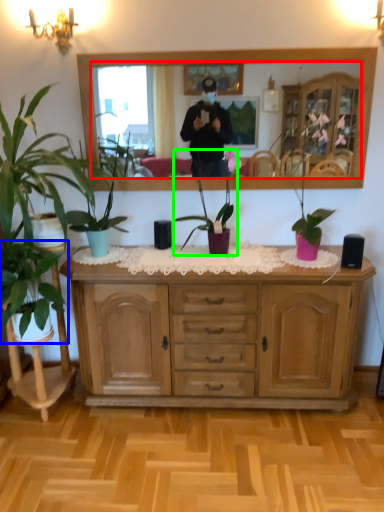
Question: Which object is the farthest from mirror (highlighted by a red box)? Choose among these: houseplant (highlighted by a blue box) or houseplant (highlighted by a green box).

Choices:
 (A) houseplant
 (B) houseplant

Answer: (A)